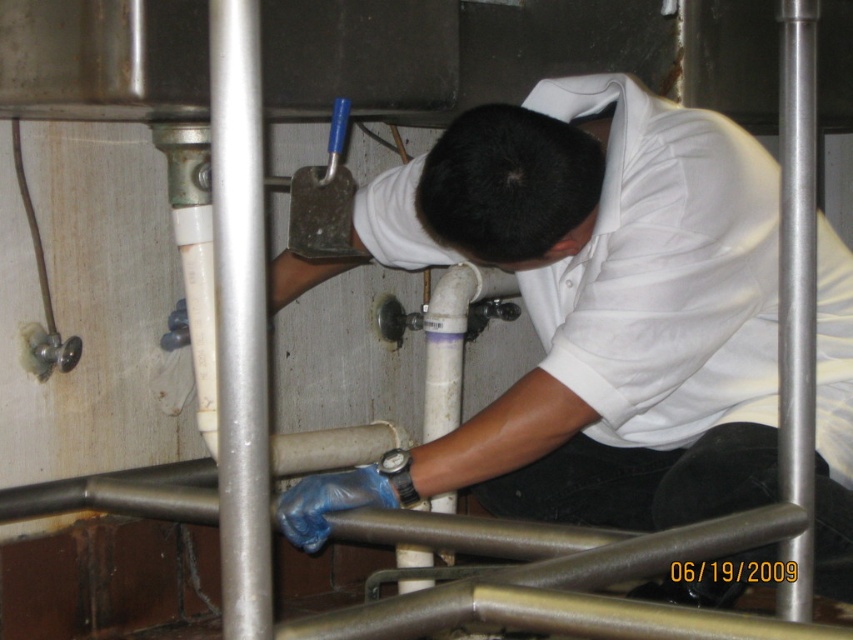
Question: Which object appears closest to the camera in this image?

Choices:
 (A) white matte shirt at center
 (B) brushed metal pipe at center left
 (C) brushed metal pipe at center right

Answer: (B)

Question: In this image, where is white matte shirt at center located relative to brushed metal pipe at center right?

Choices:
 (A) above
 (B) below

Answer: (B)

Question: Which point is farther from the camera taking this photo?

Choices:
 (A) (287, 500)
 (B) (223, 401)
 (C) (782, 141)

Answer: (A)

Question: Estimate the real-world distances between objects in this image. Which object is farther from the brushed metal pipe at center right?

Choices:
 (A) white matte shirt at center
 (B) brushed metal pipe at center left

Answer: (B)

Question: Is white matte shirt at center further to camera compared to brushed metal pipe at center left?

Choices:
 (A) no
 (B) yes

Answer: (B)

Question: Can you confirm if brushed metal pipe at center left is wider than brushed metal pipe at center right?

Choices:
 (A) yes
 (B) no

Answer: (A)